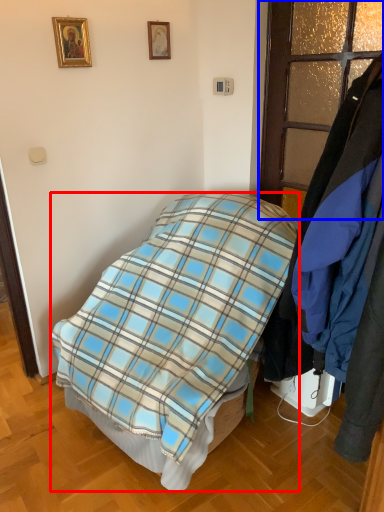
Question: Among these objects, which one is nearest to the camera, bed (highlighted by a red box) or glass door (highlighted by a blue box)?

Choices:
 (A) bed
 (B) glass door

Answer: (A)